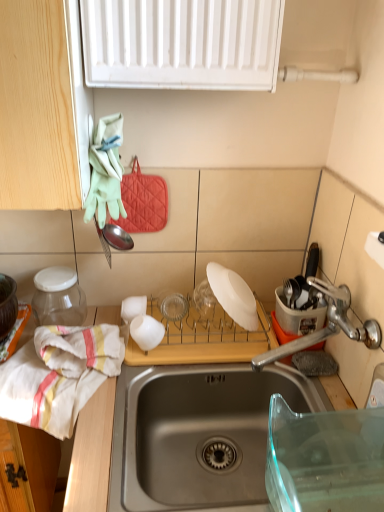
Question: In terms of height, does white cotton towel at left look taller or shorter compared to stainless steel sink at center?

Choices:
 (A) short
 (B) tall

Answer: (A)

Question: Looking at their shapes, would you say white cotton towel at left is wider or thinner than stainless steel sink at center?

Choices:
 (A) thin
 (B) wide

Answer: (A)

Question: Estimate the real-world distances between objects in this image. Which object is farther from the white matte plate at center, the second appliance from the left?

Choices:
 (A) white cotton towel at left
 (B) white matte plate at center, which is the 3th appliance from left to right
 (C) stainless steel sink at center
 (D) wooden cutting board at lower center
 (E) transparent glass jar at left, acting as the 3th appliance starting from the right

Answer: (E)

Question: Which object is positioned farthest from the white matte plate at center, arranged as the 1th appliance when viewed from the right?

Choices:
 (A) wooden cutting board at lower center
 (B) white matte cup at center
 (C) transparent glass jar at left, the 1th appliance when ordered from left to right
 (D) white cotton towel at left
 (E) stainless steel sink at center

Answer: (C)